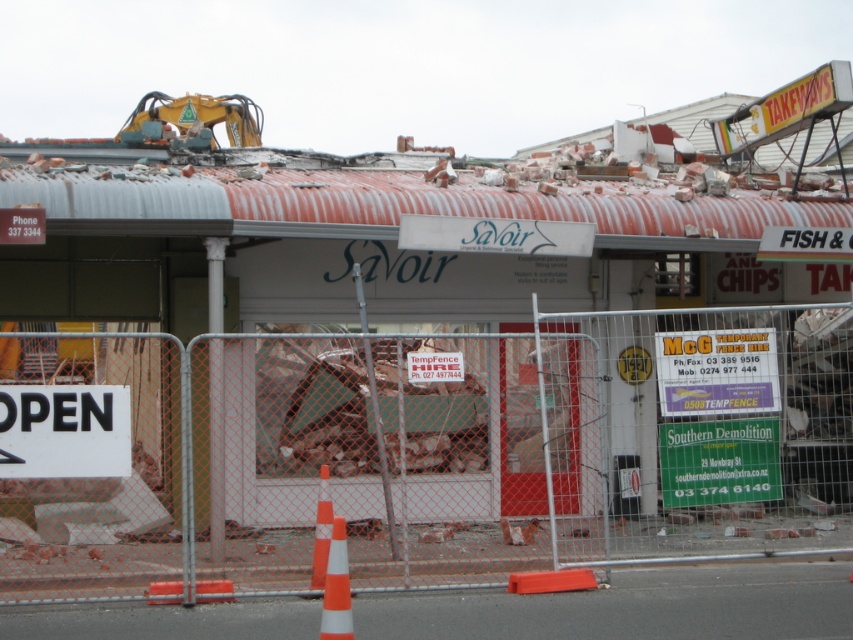
Question: Does white plastic sign at upper right come in front of white paper sign at center?

Choices:
 (A) no
 (B) yes

Answer: (A)

Question: Which point is closer to the camera?

Choices:
 (A) green plastic sign at lower center
 (B) orange chain-link fence at lower left

Answer: (B)

Question: Which point is farther from the camera taking this photo?

Choices:
 (A) (851, 257)
 (B) (688, 388)
 (C) (442, 380)

Answer: (A)

Question: Among these objects, which one is farthest from the camera?

Choices:
 (A) white plastic sign at center
 (B) orange plastic traffic cone at lower center
 (C) white plastic sign at upper right

Answer: (C)

Question: Is green plastic sign at lower center below orange plastic traffic cone at lower center?

Choices:
 (A) yes
 (B) no

Answer: (B)

Question: Does white plastic sign at center appear on the left side of orange and white striped traffic cone at center?

Choices:
 (A) no
 (B) yes

Answer: (A)